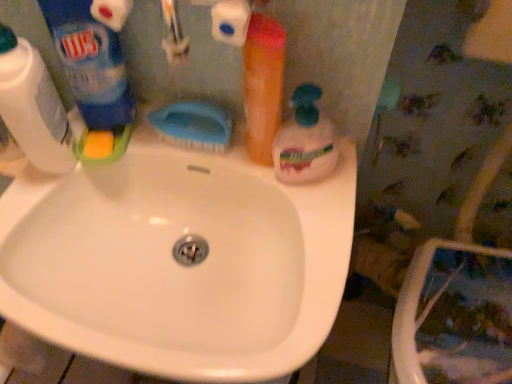
Question: From the image's perspective, is blue plastic brush at center above or below blue plastic bottle at upper left, the 2th cleaning product in the left-to-right sequence?

Choices:
 (A) below
 (B) above

Answer: (A)

Question: Based on their sizes in the image, would you say blue plastic brush at center is bigger or smaller than blue plastic bottle at upper left, the 2th cleaning product in the left-to-right sequence?

Choices:
 (A) small
 (B) big

Answer: (A)

Question: Which object is positioned closest to the translucent plastic soap dispenser at center, acting as the 4th cleaning product starting from the left?

Choices:
 (A) white glossy sink at center
 (B) translucent orange bottle at upper right, marked as the 3th cleaning product in a left-to-right arrangement
 (C) white plastic bottle at left, positioned as the 4th cleaning product in right-to-left order
 (D) blue plastic brush at center
 (E) blue plastic bottle at upper left, the 2th cleaning product in the left-to-right sequence

Answer: (B)

Question: Considering the real-world distances, which object is farthest from the translucent orange bottle at upper right, marked as the 3th cleaning product in a left-to-right arrangement?

Choices:
 (A) blue plastic brush at center
 (B) blue plastic bottle at upper left, the 2th cleaning product in the left-to-right sequence
 (C) white plastic bottle at left, positioned as the 4th cleaning product in right-to-left order
 (D) white glossy sink at center
 (E) translucent plastic soap dispenser at center, which is the first cleaning product in right-to-left order

Answer: (C)